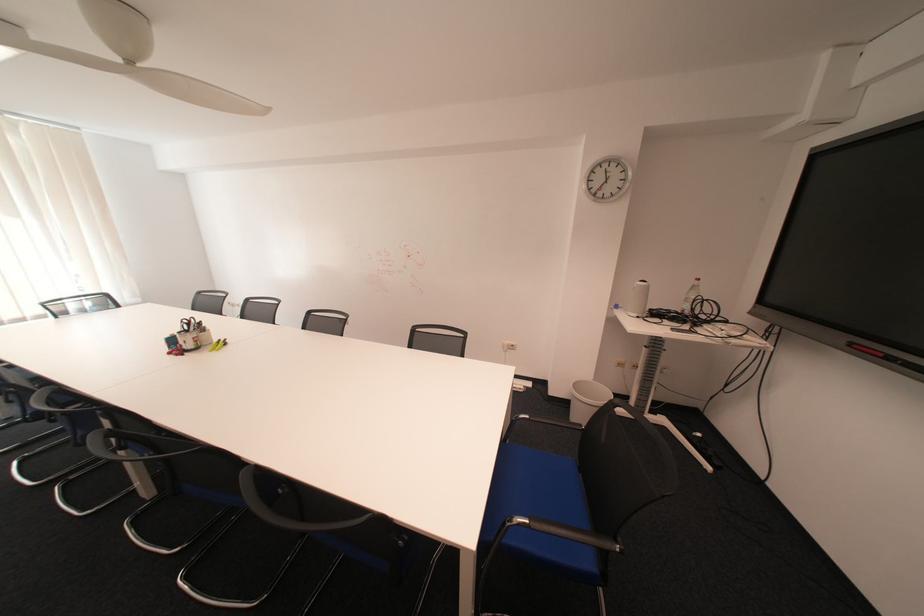
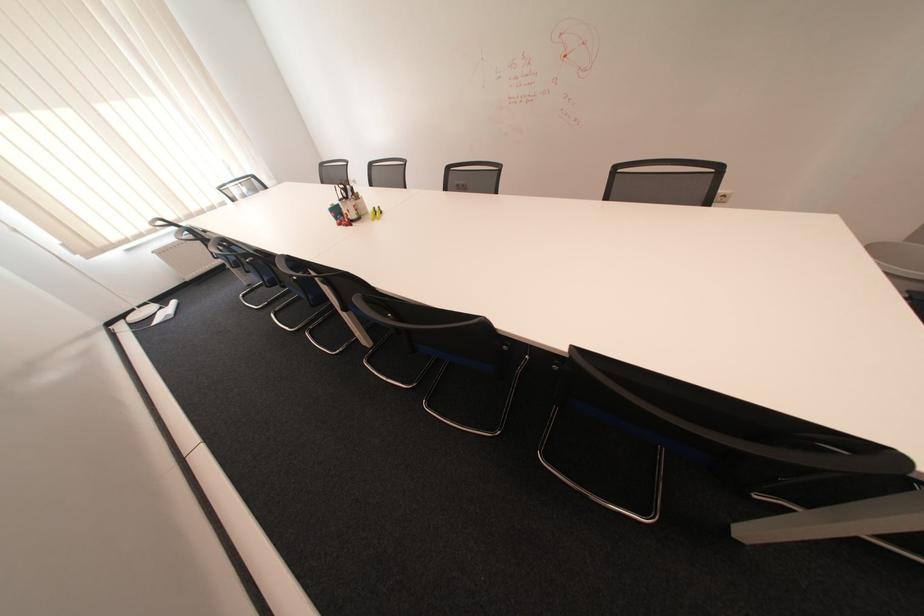
Based on the continuous images, in which direction is the camera rotating?

The camera rotated toward left-down.